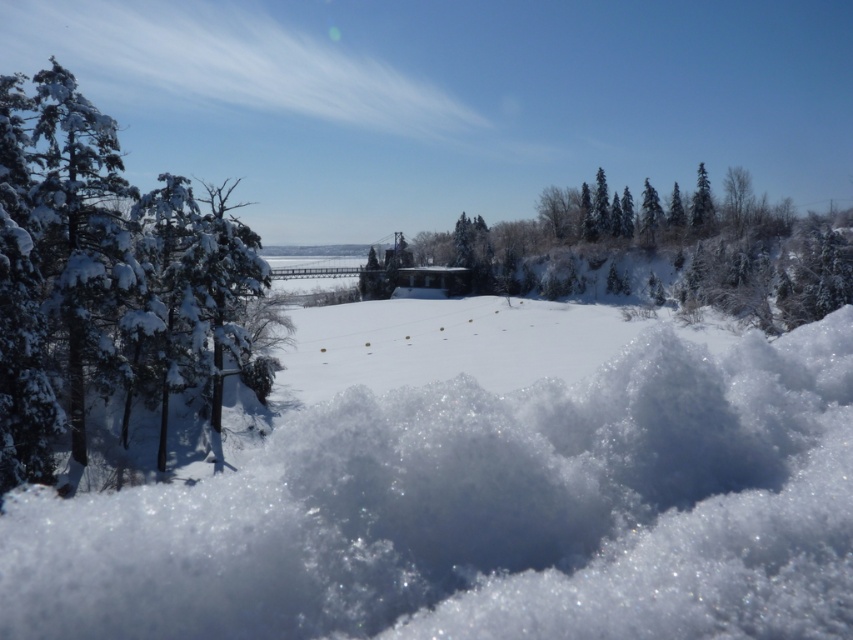
Is point (357, 448) in front of point (706, 228)?

Yes, it is in front of point (706, 228).

Is point (577, 582) behind point (703, 232)?

No, (577, 582) is closer to viewer.

What do you see at coordinates (486, 513) in the screenshot?
I see `white fluffy snow at center` at bounding box center [486, 513].

You are a GUI agent. You are given a task and a screenshot of the screen. Output one action in this format:
    pyautogui.click(x=<x>, y=<y>)
    Task: Click on the white fluffy snow at center
    The image size is (853, 640).
    Given the screenshot: What is the action you would take?
    pyautogui.click(x=486, y=513)

Consider the image. Does white fluffy snow at center have a greater width compared to snow-covered evergreen at left?

Incorrect, white fluffy snow at center's width does not surpass snow-covered evergreen at left's.

The height and width of the screenshot is (640, 853). What are the coordinates of `white fluffy snow at center` in the screenshot? It's located at (486, 513).

At what (x,y) coordinates should I click in order to perform the action: click on white fluffy snow at center. Please return your answer as a coordinate pair (x, y). The image size is (853, 640). Looking at the image, I should click on (486, 513).

Between point (376, 496) and point (728, 227), which one is positioned behind?

Positioned behind is point (728, 227).

Can you confirm if white fluffy snow at center is positioned to the right of green snow-covered trees at center?

No, white fluffy snow at center is not to the right of green snow-covered trees at center.

Which is in front, point (553, 394) or point (724, 266)?

Point (553, 394)

Image resolution: width=853 pixels, height=640 pixels. Identify the location of white fluffy snow at center. (486, 513).